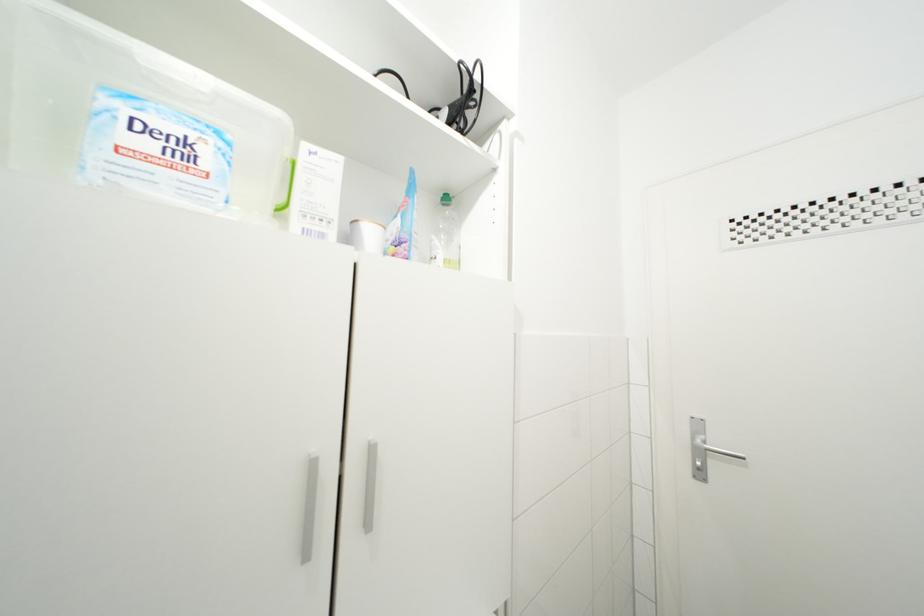
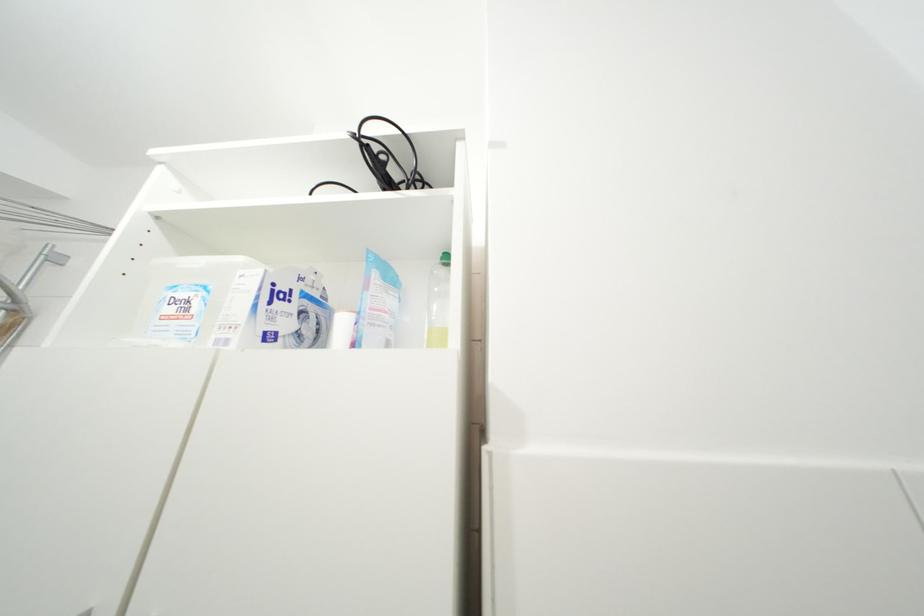
How did the camera likely rotate?

The rotation direction of the camera is left-up.